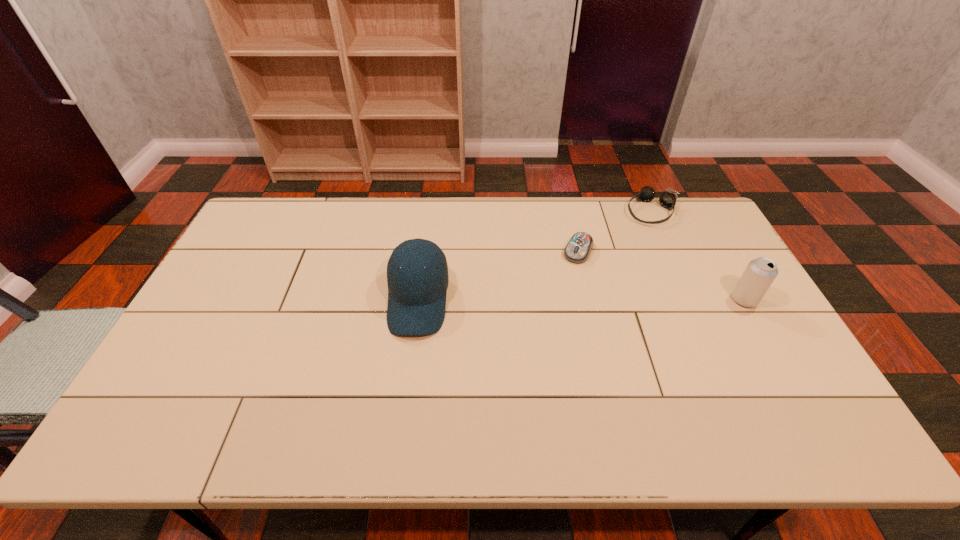
Locate an element on the screen. The height and width of the screenshot is (540, 960). free region located 0.300m on the wheel side of the shortest object is located at coordinates (539, 329).

Where is `blank area located 0.140m through the lenses of the second object from right to left`? The width and height of the screenshot is (960, 540). blank area located 0.140m through the lenses of the second object from right to left is located at coordinates (634, 248).

The image size is (960, 540). I want to click on free space located through the lenses of the second object from right to left, so click(621, 274).

The width and height of the screenshot is (960, 540). What are the coordinates of `free space located 0.080m through the lenses of the second object from right to left` in the screenshot? It's located at (638, 238).

Where is `computer mouse that is at the far edge`? Image resolution: width=960 pixels, height=540 pixels. computer mouse that is at the far edge is located at coordinates (578, 249).

This screenshot has height=540, width=960. In order to click on goggles that is positioned at the far edge in this screenshot , I will do `click(667, 199)`.

Where is `beer can that is at the right edge`? The width and height of the screenshot is (960, 540). beer can that is at the right edge is located at coordinates (760, 273).

The width and height of the screenshot is (960, 540). Find the location of `goggles located in the right edge section of the desktop`. goggles located in the right edge section of the desktop is located at coordinates (667, 199).

You are a GUI agent. You are given a task and a screenshot of the screen. Output one action in this format:
    pyautogui.click(x=<x>, y=<y>)
    Task: Click on the object situated at the far right corner
    This screenshot has height=540, width=960.
    Given the screenshot: What is the action you would take?
    pyautogui.click(x=667, y=199)

I want to click on vacant space at the far edge of the desktop, so click(x=579, y=206).